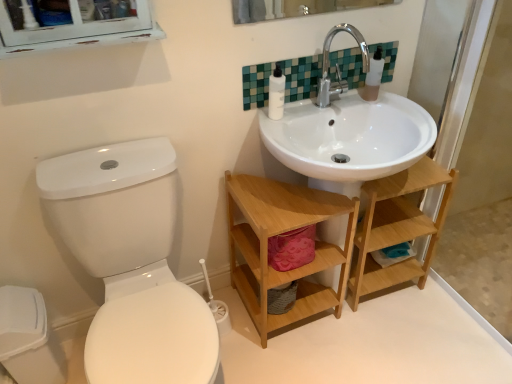
Question: From a real-world perspective, is white matte toilet paper at lower right above or below white glossy toilet at left?

Choices:
 (A) above
 (B) below

Answer: (B)

Question: In terms of size, does white matte toilet paper at lower right appear bigger or smaller than white glossy toilet at left?

Choices:
 (A) big
 (B) small

Answer: (B)

Question: Estimate the real-world distances between objects in this image. Which object is closer to the wooden shelf at lower center, marked as the 2th shelf in a right-to-left arrangement?

Choices:
 (A) white glossy toilet at left
 (B) transparent plastic soap dispenser at upper right
 (C) white matte toilet paper at lower right
 (D) silver metallic faucet at upper center
 (E) white plastic bottle at upper center

Answer: (A)

Question: Estimate the real-world distances between objects in this image. Which object is farther from the white glossy toilet at left?

Choices:
 (A) white matte toilet paper at lower right
 (B) white plastic bottle at upper center
 (C) green mosaic tile at upper center
 (D) transparent glass screen door at right
 (E) transparent plastic soap dispenser at upper right

Answer: (D)